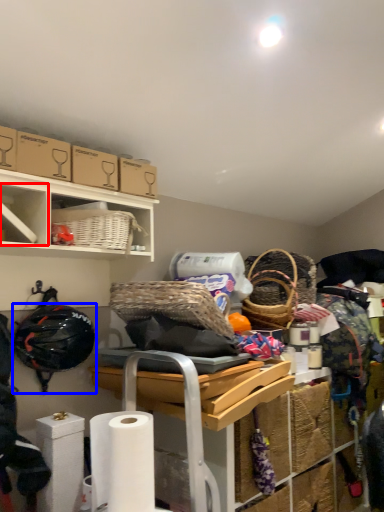
Question: Which point is further to the camera, cabinet (highlighted by a red box) or helmet (highlighted by a blue box)?

Choices:
 (A) cabinet
 (B) helmet

Answer: (B)